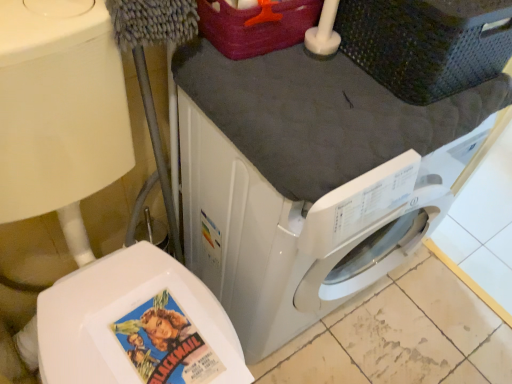
The image size is (512, 384). Identify the location of free spot above white glossy washing machine at center (from a real-world perspective). (340, 105).